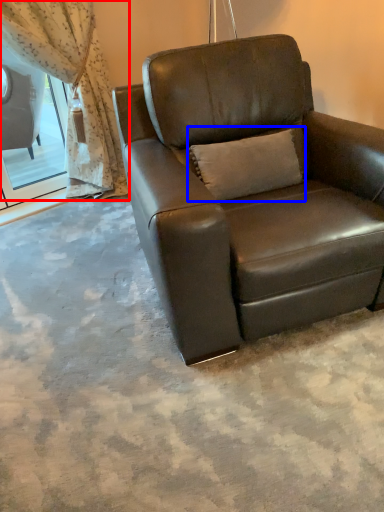
Question: Which point is further to the camera, curtain (highlighted by a red box) or pillow (highlighted by a blue box)?

Choices:
 (A) curtain
 (B) pillow

Answer: (A)